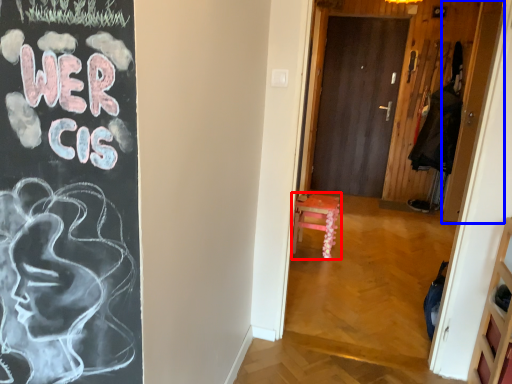
Question: Among these objects, which one is farthest to the camera, furniture (highlighted by a red box) or door (highlighted by a blue box)?

Choices:
 (A) furniture
 (B) door

Answer: (B)